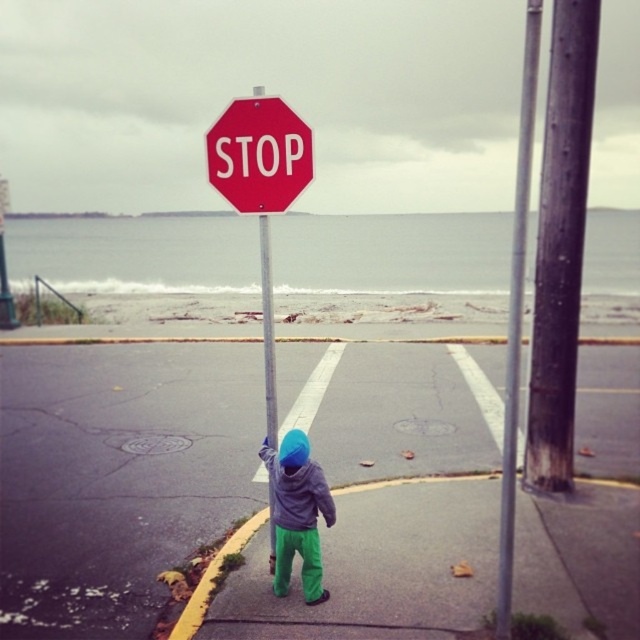
You are a pedestrian approaching the intersection and see the red matte stop sign at upper center and the gray fleece hoodie at center. Which object is closer to you?

The red matte stop sign at upper center is closer to you because it is positioned further to the viewer than the gray fleece hoodie at center.

You are a pedestrian approaching the coastal road intersection. You see the red matte stop sign at center. Where exactly is the stop sign located relative to the point marked at coordinates (260,188)?

The red matte stop sign at center is located exactly at the point marked at coordinates (260,188).

You are a pedestrian approaching the intersection. You see the smooth asphalt road at center and the red matte stop sign at center. Which object is positioned to the right when facing the intersection?

The smooth asphalt road at center is to the right of the red matte stop sign at center when facing the intersection.